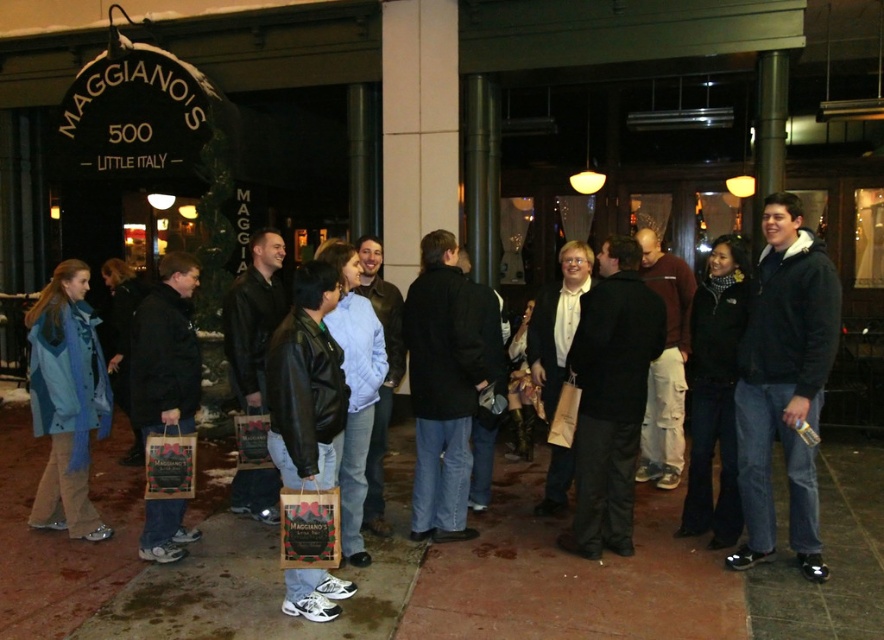
Does matte black jacket at center have a larger size compared to leather jacket at center?

Yes, matte black jacket at center is bigger than leather jacket at center.

Is matte black jacket at center positioned before leather jacket at center?

No, it is behind leather jacket at center.

Does point (679, 378) come behind point (322, 340)?

Yes, point (679, 378) is behind point (322, 340).

Where is `matte black jacket at center`? matte black jacket at center is located at coordinates (692, 385).